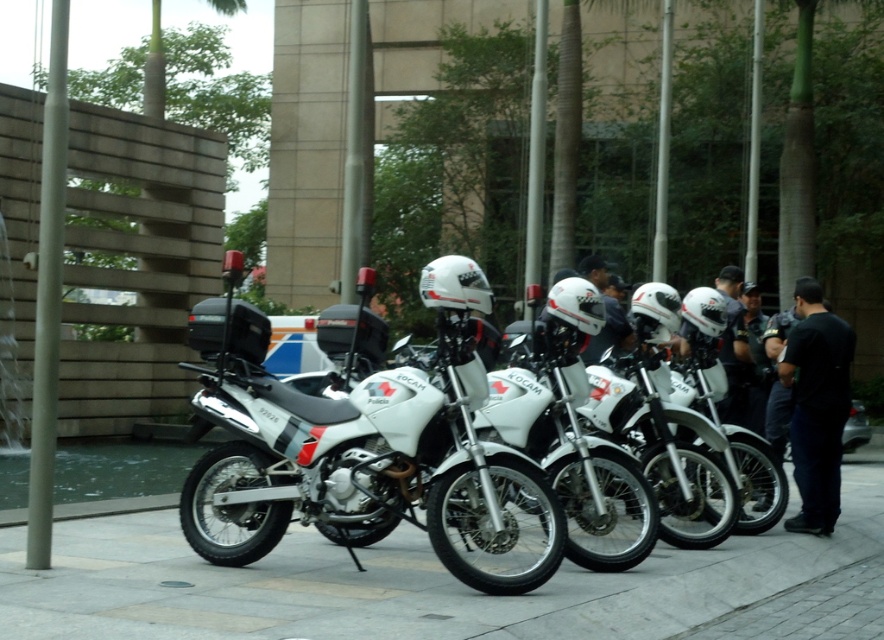
You are standing at the entrance of the building and want to locate the white matte motorcycle at center. According to the coordinates provided, where should you look relative to the building?

The white matte motorcycle at center is located at coordinates point (375, 456), which means it is positioned to the right and slightly above the entrance of the building.

From the picture: You are a photographer trying to capture a clear shot of the white matte motorcycle at center without any obstructions. Based on the scene, can you tell if the black matte shirt at center is blocking the view of the motorcycle?

The white matte motorcycle at center is in front of the black matte shirt at center, so the motorcycle is not blocked and you can capture a clear shot without obstructions.